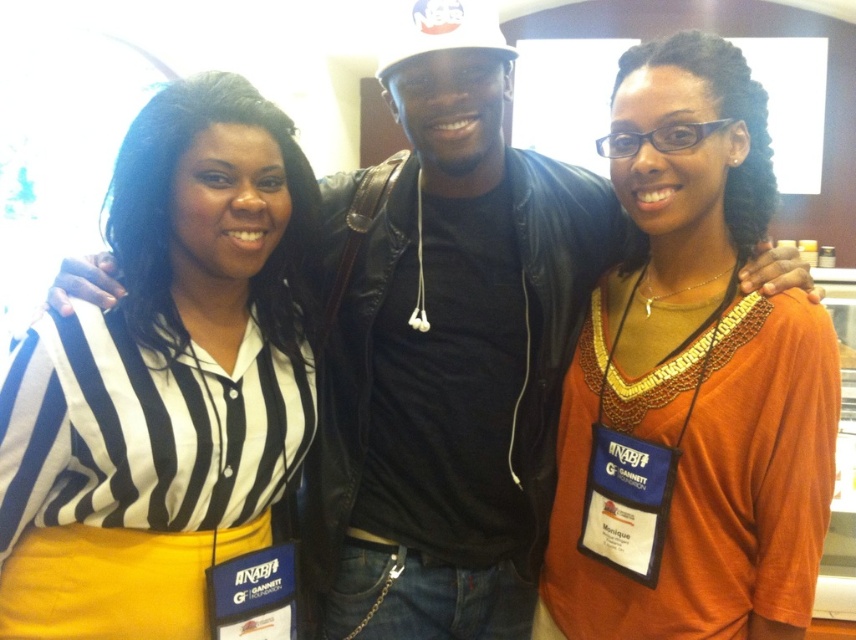
You are standing in front of the image and want to locate the black striped shirt at left. What are its coordinates?

The black striped shirt at left is located at coordinates 0.608 on the x axis and 0.197 on the y axis.

Consider the image. You are organizing a group photo and need to arrange two people so that the wider person is on the left side of the frame. Given the black striped shirt at left and orange fabric shirt at center, which person should be placed on the left to meet this requirement?

The black striped shirt at left is wider than the orange fabric shirt at center, so placing the black striped shirt at left on the left side of the frame meets the requirement.

You are standing in the conference room where the photo was taken. You see two points marked in the image. The first point is at coordinates point [70,621] and the second point is at point [688,579]. If you were to walk from the first point to the second point, would you be moving towards the person on the right or away from them?

The point [70,621] is in front of point [688,579]. Therefore, moving from the first point to the second point would mean moving away from the person on the right.